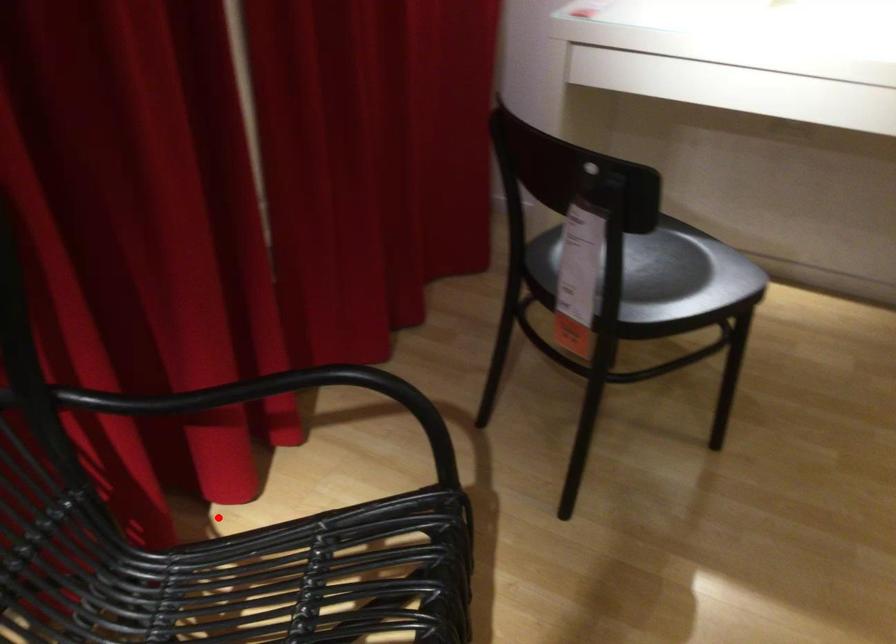
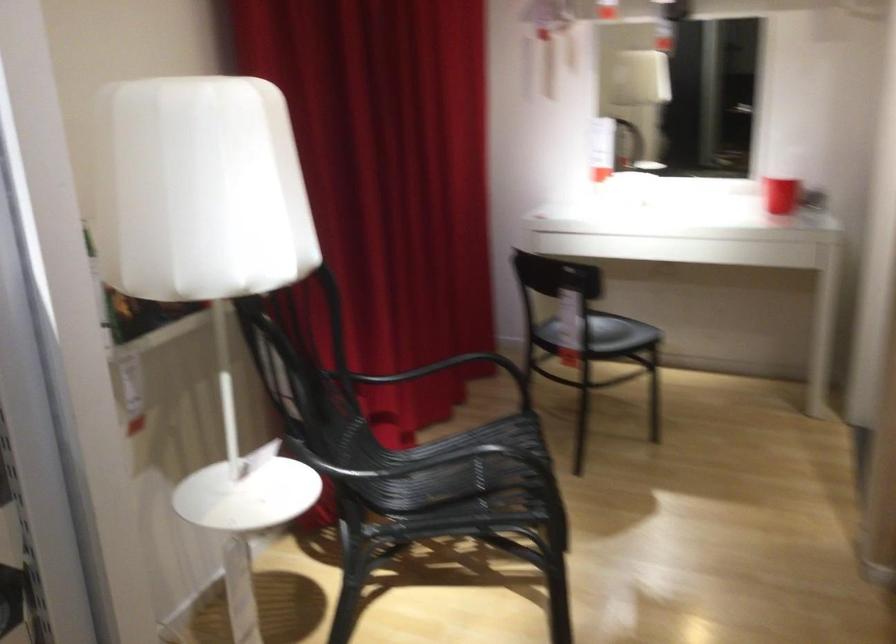
Question: I am providing you with two images of the same scene from different viewpoints. A red point is marked on the first image. Can you still see the location of the red point in image 2?

Choices:
 (A) Yes
 (B) No

Answer: (B)